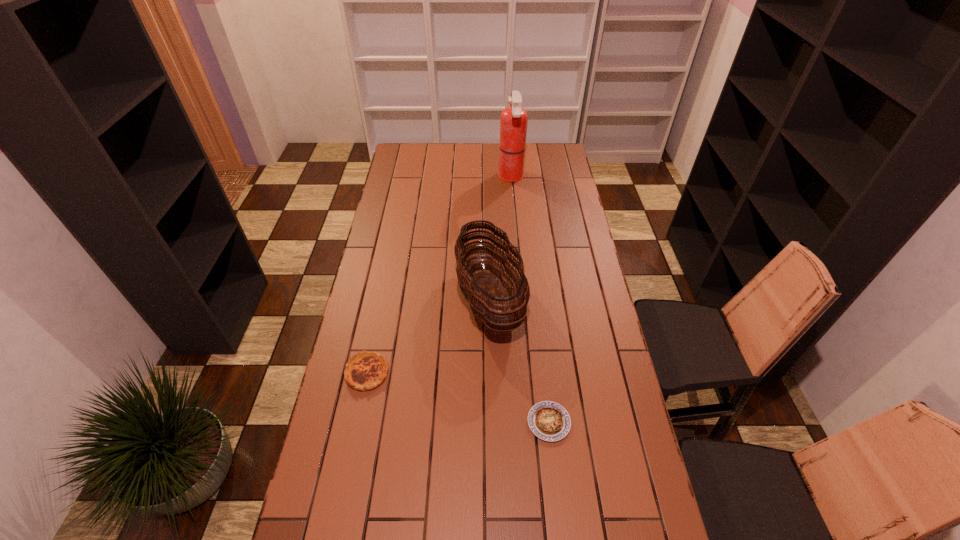
Where is `the farthest object`? This screenshot has width=960, height=540. the farthest object is located at coordinates (513, 122).

Find the location of a particular element. This screenshot has width=960, height=540. fire extinguisher is located at coordinates (513, 122).

Identify the location of basket. This screenshot has height=540, width=960. (485, 293).

Locate an element on the screen. This screenshot has width=960, height=540. the second farthest object is located at coordinates (485, 293).

The width and height of the screenshot is (960, 540). I want to click on the third farthest object, so tap(365, 370).

Locate an element on the screen. The height and width of the screenshot is (540, 960). the second shortest object is located at coordinates (365, 370).

This screenshot has height=540, width=960. I want to click on the nearer quiche, so click(549, 421).

Identify the location of the shorter quiche. (549, 421).

Find the location of a particular element. vacant space located with the handle and hose on the farthest object is located at coordinates (464, 177).

Find the location of a particular element. The image size is (960, 540). free space located with the handle and hose on the farthest object is located at coordinates (482, 177).